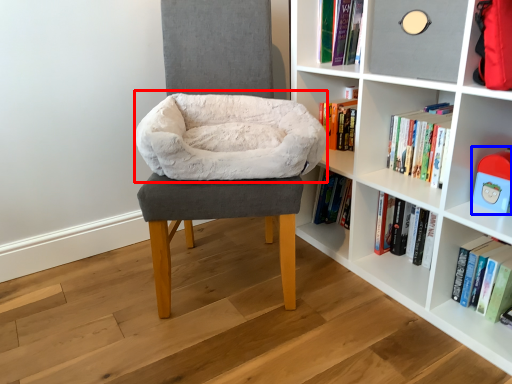
Question: Which object is closer to the camera taking this photo, bean bag chair (highlighted by a red box) or toy (highlighted by a blue box)?

Choices:
 (A) bean bag chair
 (B) toy

Answer: (B)